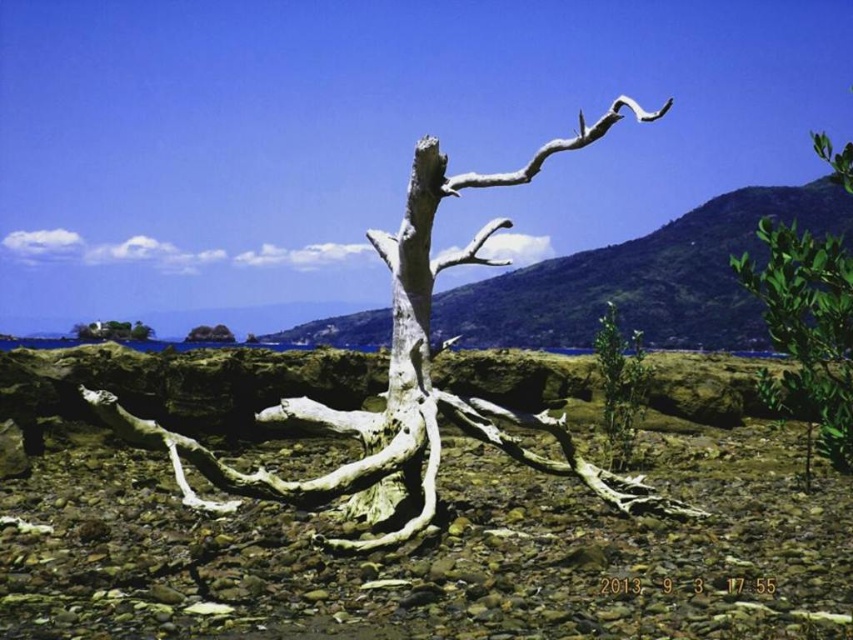
You are a photographer wanting to capture the smooth gray tree trunk at lower left and the white textured driftwood at center in your shot. Based on their positions, which object should you focus on first if you want to include both in the frame without moving the camera?

The smooth gray tree trunk at lower left is above the white textured driftwood at center, so you should focus on the smooth gray tree trunk at lower left first since it is closer to the camera and occupies a higher position in the frame.

You are a hiker who has come across this coastal landscape. You need to place a small marker exactly at the center of the white rough wood at center. What coordinates should you use?

The coordinates for the white rough wood at center are point (x=409, y=381), so you should place the marker at those coordinates.

You are an artist planning to paint this coastal landscape. You want to ensure the white rough wood at center and the green leafy bush at right are proportionally accurate. Based on the scene, which object should you paint as narrower?

The white rough wood at center should be painted as narrower since its width is less than the green leafy bush at right.